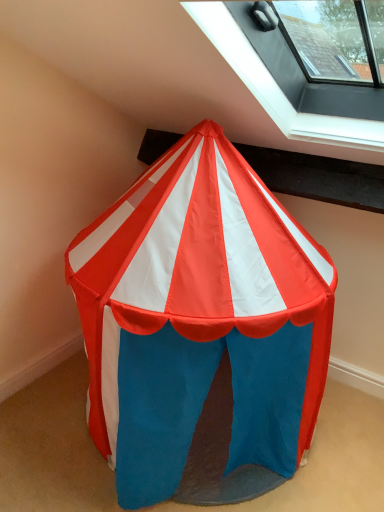
Question: Should I look upward or downward to see transparent glass window at upper right?

Choices:
 (A) down
 (B) up

Answer: (B)